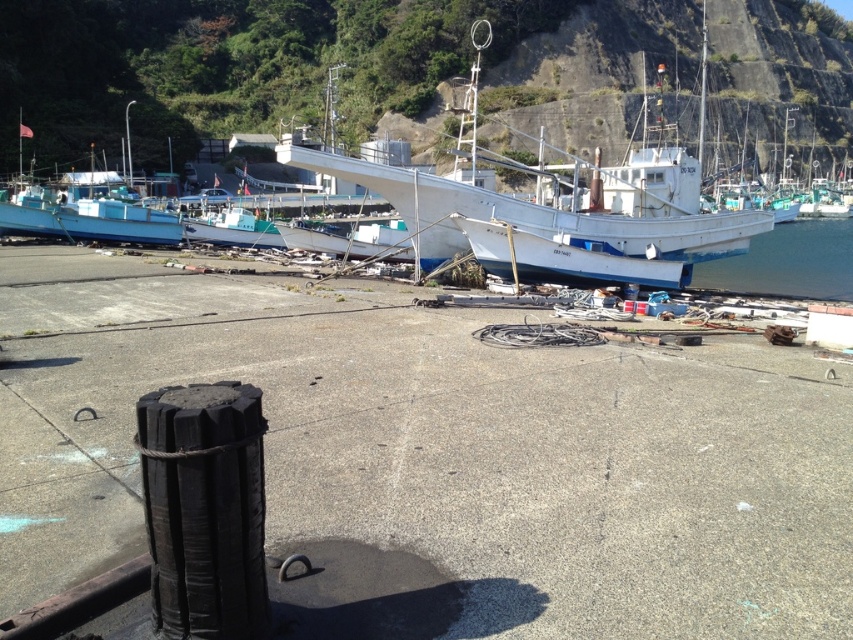
Who is more forward, (845, 26) or (660, 176)?

Point (660, 176) is more forward.

Can you confirm if brushed metal hillside at upper center is positioned to the left of white matte boat at center?

No, brushed metal hillside at upper center is not to the left of white matte boat at center.

In the scene shown: Measure the distance between brushed metal hillside at upper center and camera.

A distance of 48.00 meters exists between brushed metal hillside at upper center and camera.

Where is `brushed metal hillside at upper center`? The height and width of the screenshot is (640, 853). brushed metal hillside at upper center is located at coordinates (229, 65).

Consider the image. Is white matte boat at center positioned in front of clear water at lower right?

Yes, white matte boat at center is in front of clear water at lower right.

Can you confirm if white matte boat at center is positioned below clear water at lower right?

No, white matte boat at center is not below clear water at lower right.

In order to click on white matte boat at center in this screenshot , I will do `click(558, 205)`.

Does brushed metal hillside at upper center appear under clear water at lower right?

No.

Is point (360, 125) less distant than point (753, 289)?

No, it is behind (753, 289).

Between point (381, 74) and point (840, 291), which one is positioned in front?

Positioned in front is point (840, 291).

In order to click on brushed metal hillside at upper center in this screenshot , I will do `click(229, 65)`.